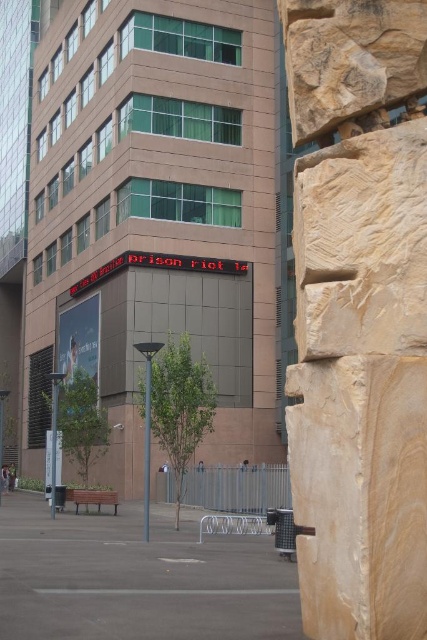
You are a city planner evaluating the space in front of the modern building. You need to determine if the brown concrete plaza at center can accommodate a new sculpture that requires a space larger than the sandstone textured wall at right. Based on the scene, can the plaza accommodate the sculpture?

The brown concrete plaza at center is larger in size than the sandstone textured wall at right, so yes, the plaza can accommodate the sculpture as it has a larger area available.